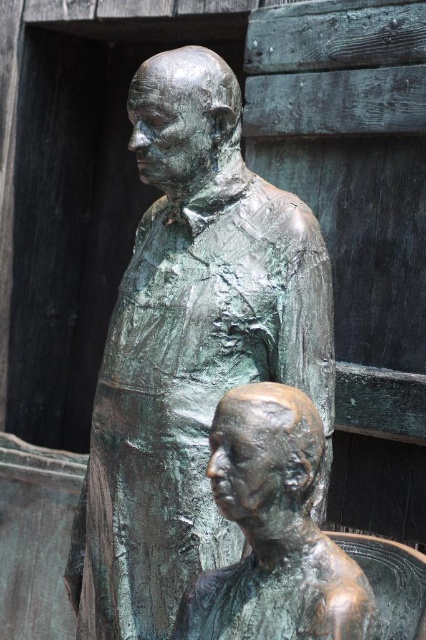
Does green patina statue at center have a lesser height compared to bronze statue at lower center?

Incorrect, green patina statue at center's height does not fall short of bronze statue at lower center's.

You are a GUI agent. You are given a task and a screenshot of the screen. Output one action in this format:
    pyautogui.click(x=<x>, y=<y>)
    Task: Click on the green patina statue at center
    This screenshot has width=426, height=640.
    Given the screenshot: What is the action you would take?
    pyautogui.click(x=189, y=348)